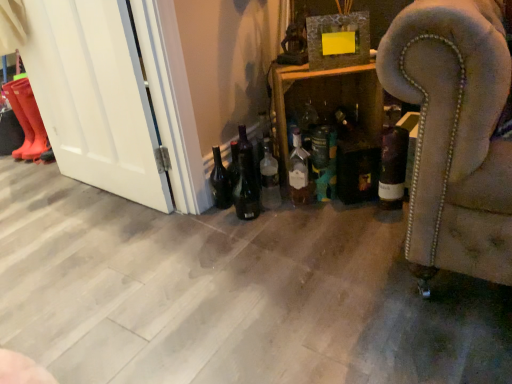
Where is `blank area to the left of translucent glass bottle at center, placed as the first bottle when sorted from left to right`? blank area to the left of translucent glass bottle at center, placed as the first bottle when sorted from left to right is located at coordinates (223, 222).